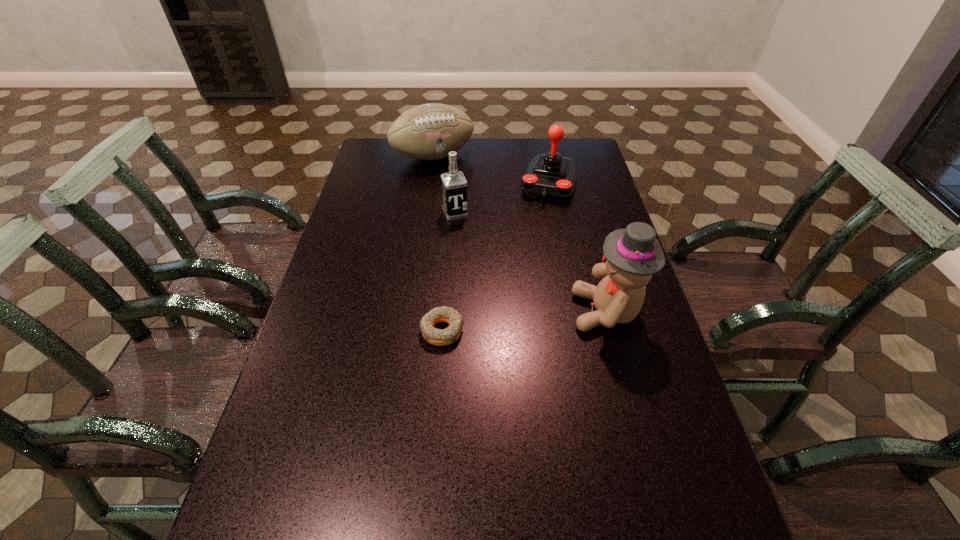
What are the coordinates of `free spot on the desktop that is between the shortest object and the tallest object and is positioned on the front label of the vodka` in the screenshot? It's located at (505, 323).

Identify the location of vacant spot on the desktop that is between the shortest object and the rag_doll and is positioned on the base of the joystick. (502, 323).

The height and width of the screenshot is (540, 960). What are the coordinates of `vacant space on the desktop that is between the doughnut and the tallest object and is positioned on the laces of the football (American)` in the screenshot? It's located at (544, 319).